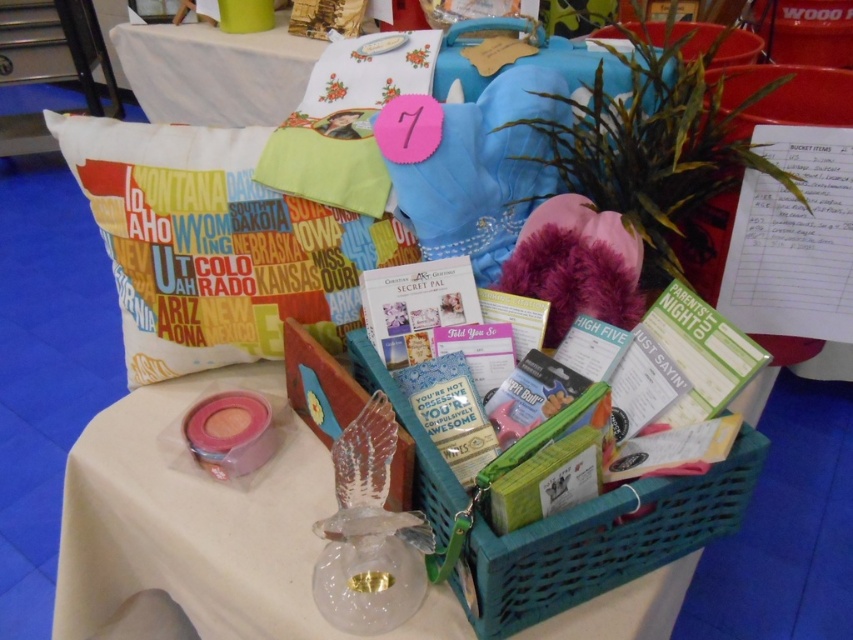
Based on the photo, you are organizing a community event and need to place a new item between the clear glass bird at center and the white fabric pillow at upper left. Where should you place it to ensure it is between them?

The clear glass bird at center is below the white fabric pillow at upper left, so placing the new item between them would require positioning it above the clear glass bird at center and below the white fabric pillow at upper left.

In the scene shown: You are standing at the center of the table and want to place a new item exactly at the center of the table. The white fabric pillow at upper left is located at coordinates 0.383, 0.253. Can you determine if the pillow is closer to the left edge or the right edge of the table?

Result: The white fabric pillow at upper left is located at coordinates (215, 244). Since the x coordinate is 0.383, which is less than 0.5, the pillow is closer to the left edge of the table.

You are setting up a display for a community event and need to place a small decorative item on top of the white fabric pillow at upper left and the teal plastic basket at center. Which object can support a taller item?

The white fabric pillow at upper left can support a taller item because it has a greater height compared to the teal plastic basket at center.